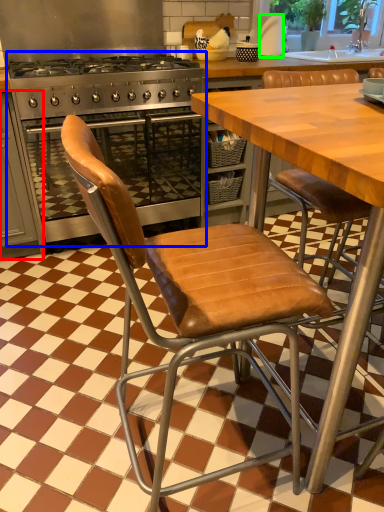
Question: Based on their relative distances, which object is farther from cabinetry (highlighted by a red box)? Choose from kitchen appliance (highlighted by a blue box) and paper towel (highlighted by a green box).

Choices:
 (A) kitchen appliance
 (B) paper towel

Answer: (B)